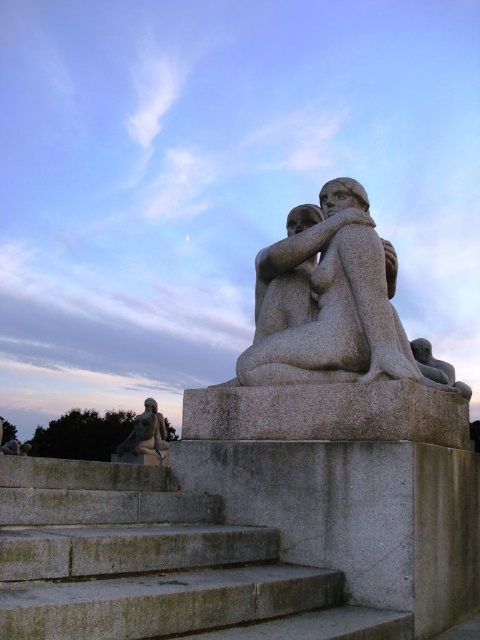
Question: Which of the following is the farthest from the observer?

Choices:
 (A) (0, 464)
 (B) (151, 445)

Answer: (B)

Question: Which is farther from the granite statue at center?

Choices:
 (A) smooth gray stone figure at lower left
 (B) gray concrete stairs at lower center

Answer: (A)

Question: Which point is farther to the camera?

Choices:
 (A) smooth gray stone figure at lower left
 (B) gray concrete stairs at lower center

Answer: (A)

Question: Is gray concrete stairs at lower center to the left of granite statue at center from the viewer's perspective?

Choices:
 (A) no
 (B) yes

Answer: (B)

Question: Can you confirm if gray concrete stairs at lower center is positioned to the left of granite statue at center?

Choices:
 (A) no
 (B) yes

Answer: (B)

Question: Can you confirm if gray concrete stairs at lower center is positioned below smooth gray stone figure at lower left?

Choices:
 (A) no
 (B) yes

Answer: (A)